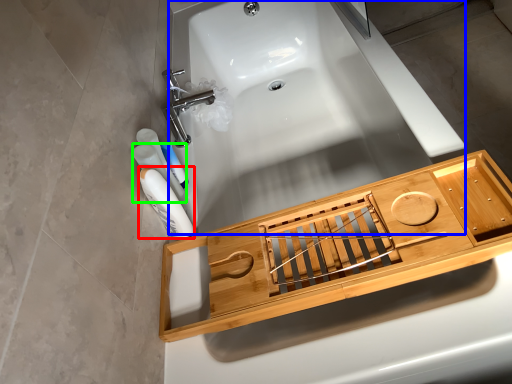
Question: Considering the real-world distances, which object is farthest from mouthwash (highlighted by a red box)? bath (highlighted by a blue box) or mouthwash (highlighted by a green box)?

Choices:
 (A) bath
 (B) mouthwash

Answer: (A)